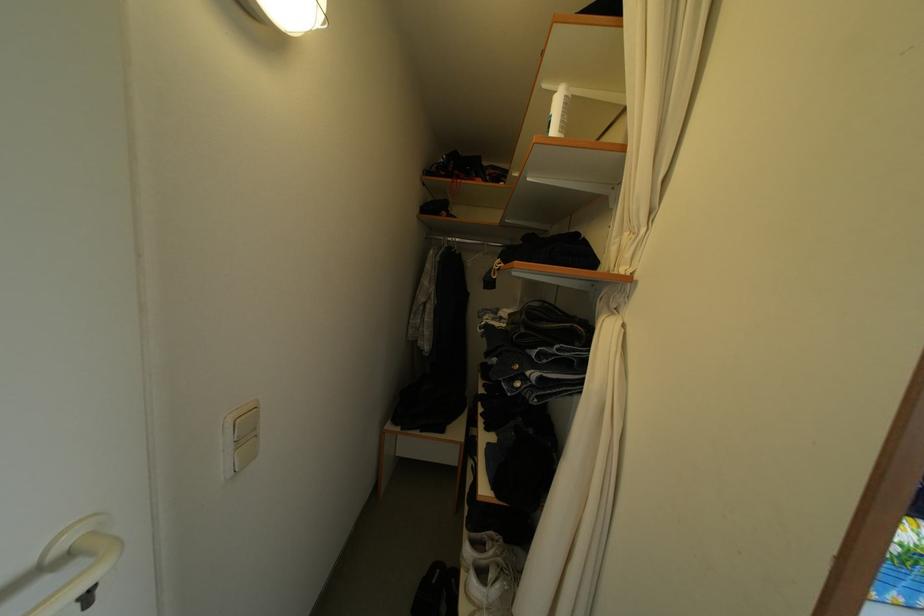
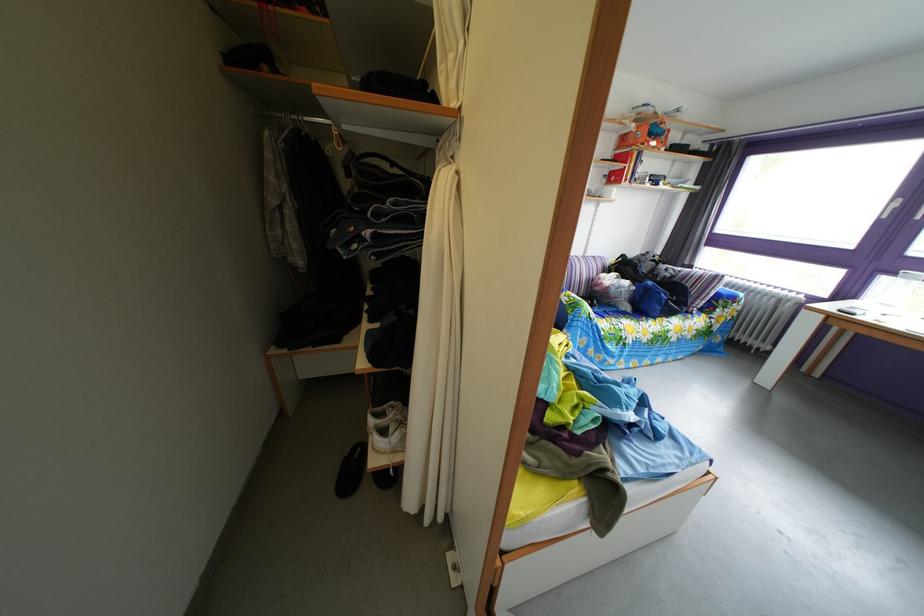
Find the pixel in the second image that matches pixel 601 355 in the first image.

(438, 207)